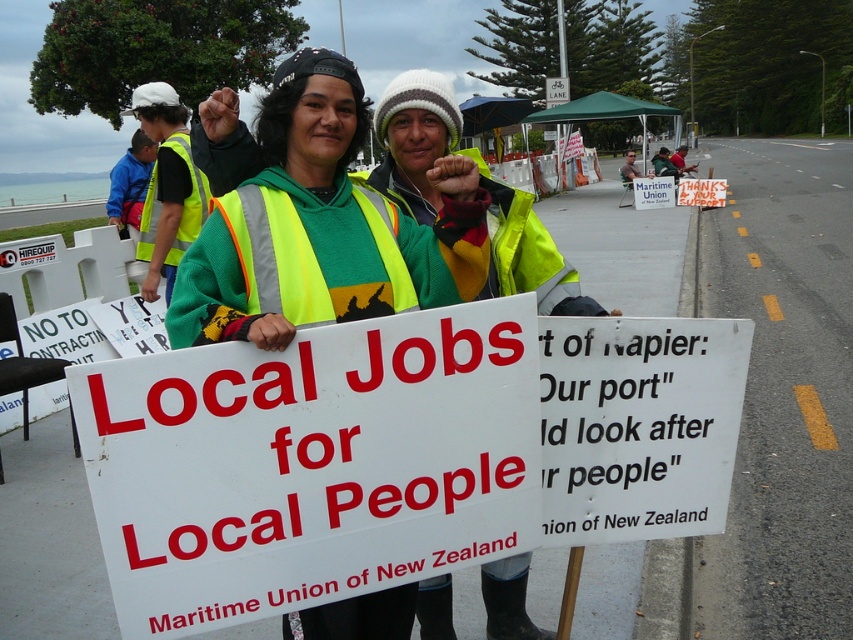
Question: Is neon yellow reflective safety vest at center further to the viewer compared to high visibility yellow vest at left?

Choices:
 (A) no
 (B) yes

Answer: (A)

Question: Where is white paper sign at center located in relation to high visibility yellow vest at left in the image?

Choices:
 (A) below
 (B) above

Answer: (A)

Question: Which point is closer to the camera?

Choices:
 (A) white paper sign at center
 (B) reflective yellow vest at center

Answer: (A)

Question: Is reflective yellow safety vest at center thinner than reflective yellow vest at center?

Choices:
 (A) yes
 (B) no

Answer: (B)

Question: Which of the following is the farthest from the observer?

Choices:
 (A) high visibility yellow vest at left
 (B) reflective yellow vest at center
 (C) reflective yellow safety vest at center

Answer: (A)

Question: Which object is farther from the camera taking this photo?

Choices:
 (A) reflective yellow vest at center
 (B) high visibility yellow vest at left
 (C) neon yellow reflective safety vest at center

Answer: (B)